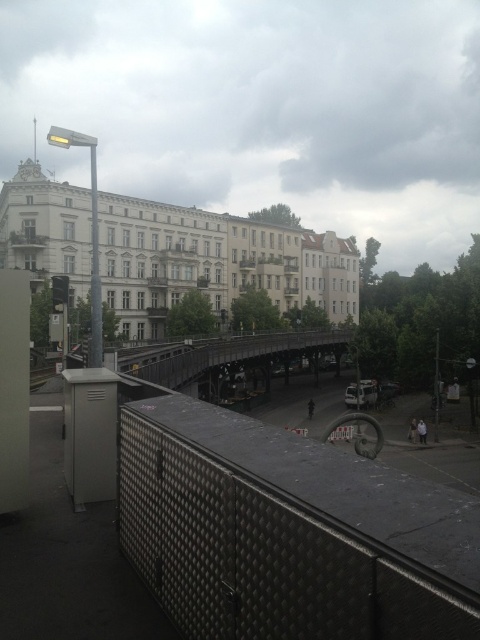
You are a tailor observing two jackets in an urban setting. You need to determine which jacket is smaller. You see the white matte jacket at lower center and the light brown leather jacket at lower right. Which one is smaller?

A: The white matte jacket at lower center is smaller compared to the light brown leather jacket at lower right.

You are a photographer standing on the metallic gray bridge at center and want to take a picture of the white matte jacket at lower center. Considering the height difference between them, will the jacket be fully visible in your photo without any obstruction?

The metallic gray bridge at center is taller than the white matte jacket at lower center, so the jacket will be fully visible in the photo without obstruction as it is lower and not blocked by the bridge.

You are standing on the metallic gray bridge at center and want to see the white matte jacket at lower center. Which direction should you look to see it?

The white matte jacket at lower center is below the metallic gray bridge at center, so you should look downward to see it.